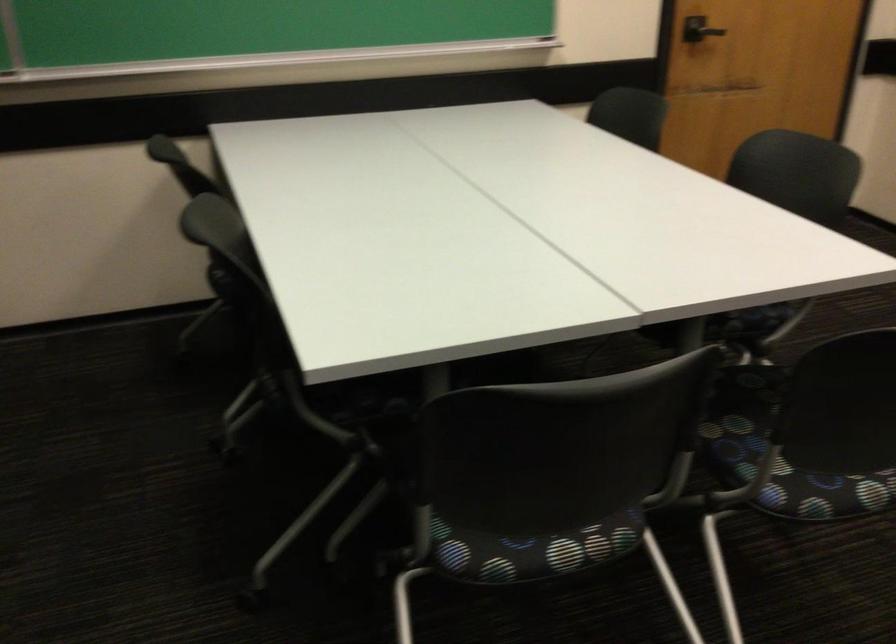
Find where to pull the black door handle. Please return your answer as a coordinate pair (x, y).

(699, 29)